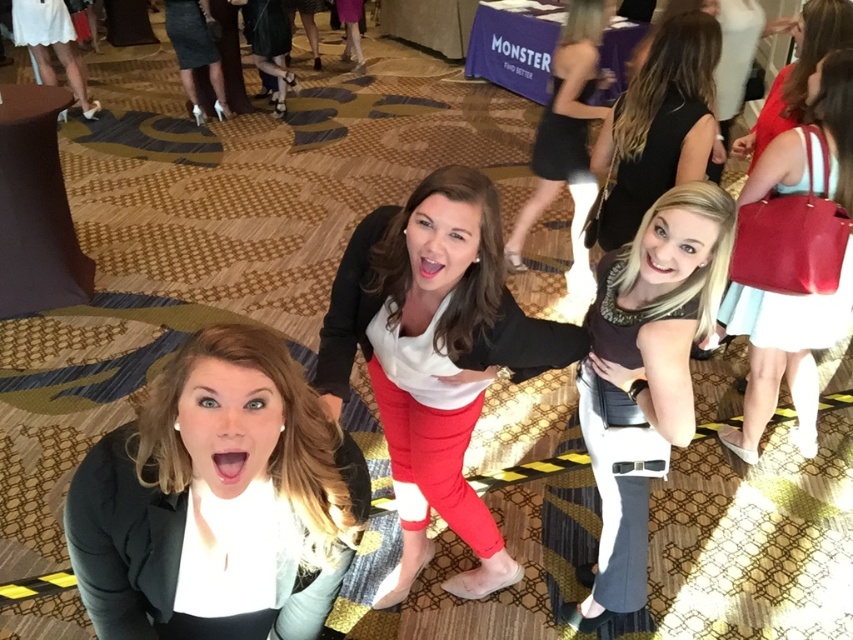
Between matte black top at center and black leather dress at center, which one appears on the right side from the viewer's perspective?

Positioned to the right is black leather dress at center.

Between matte black top at center and black leather dress at center, which one has less height?

With less height is matte black top at center.

Identify the location of matte black top at center. (643, 378).

Which is more to the right, white matte shirt at center or black leather dress at center?

From the viewer's perspective, black leather dress at center appears more on the right side.

Does white matte shirt at center have a larger size compared to black leather dress at center?

Actually, white matte shirt at center might be smaller than black leather dress at center.

Identify the location of white matte shirt at center. Image resolution: width=853 pixels, height=640 pixels. (434, 358).

Identify the location of white matte shirt at center. (434, 358).

This screenshot has height=640, width=853. What do you see at coordinates (793, 259) in the screenshot? I see `matte red handbag at right` at bounding box center [793, 259].

The image size is (853, 640). Identify the location of matte red handbag at right. (793, 259).

I want to click on matte red handbag at right, so coord(793,259).